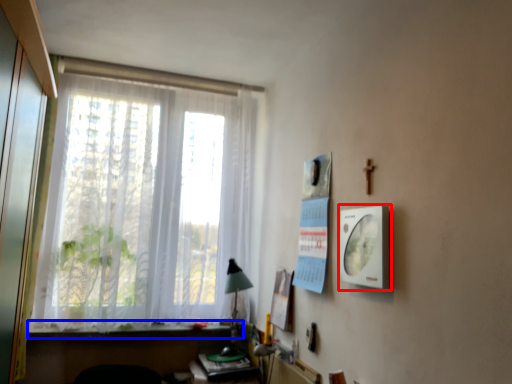
Question: Which of the following is the closest to the observer, picture frame (highlighted by a red box) or window sill (highlighted by a blue box)?

Choices:
 (A) picture frame
 (B) window sill

Answer: (A)